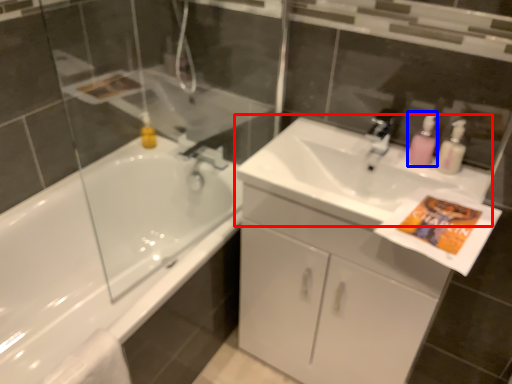
Question: Which point is further to the camera, sink (highlighted by a red box) or soap dispenser (highlighted by a blue box)?

Choices:
 (A) sink
 (B) soap dispenser

Answer: (B)